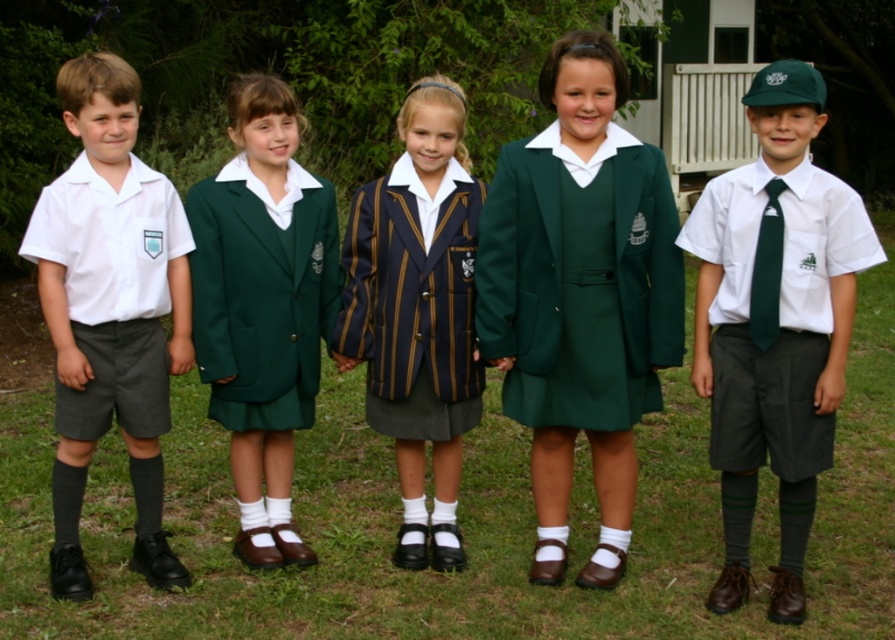
You are a photographer trying to capture a photo of the children in the scene. You notice two specific points marked in the image. Which point, point 1 at coordinates (695, 488) or point 2 at (858, 253), is closer to your camera lens?

Point 1 at coordinates (695, 488) is closer to the camera lens because it is further to the viewer than point 2 at (858, 253).

You are a tailor measuring garments for alterations. You have a striped wool blazer at center and a green satin tie at right. Which item requires a wider measurement for the hem? Please explain based on their sizes.

The striped wool blazer at center requires a wider measurement for the hem since it is wider than the green satin tie at right.

You are a photographer adjusting the camera to focus on the striped wool blazer at center and the green satin tie at right. Which object should you adjust your focus to first if you want to capture both in sharp detail?

The green satin tie at right is behind the striped wool blazer at center, so you should focus on the striped wool blazer at center first to ensure both are in sharp detail.